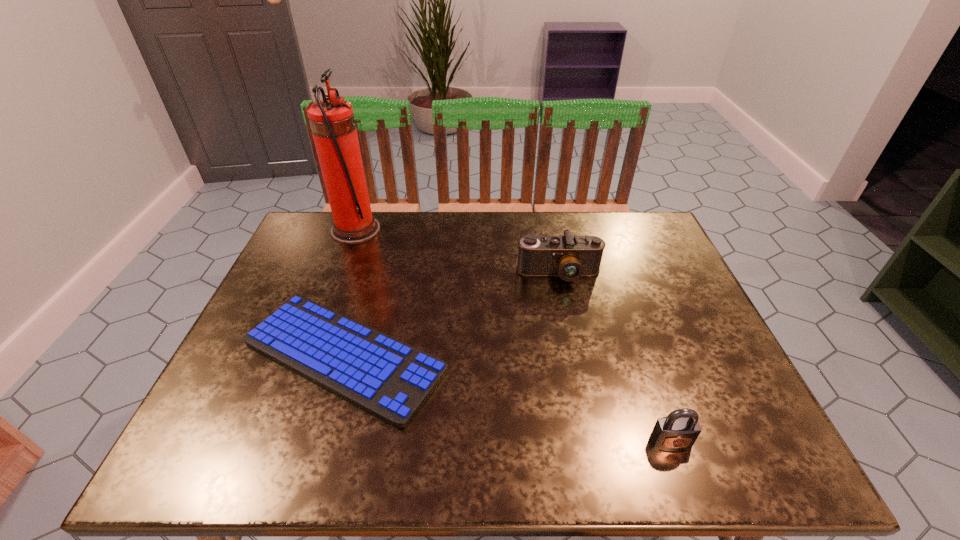
Where is `fire extinguisher`? This screenshot has width=960, height=540. fire extinguisher is located at coordinates (332, 122).

Locate an element on the screen. The image size is (960, 540). the farthest object is located at coordinates (332, 122).

Locate an element on the screen. This screenshot has height=540, width=960. the second farthest object is located at coordinates (569, 257).

The image size is (960, 540). In order to click on the nearest object in this screenshot , I will do `click(679, 430)`.

I want to click on the shortest object, so click(389, 379).

Locate an element on the screen. This screenshot has width=960, height=540. computer keyboard is located at coordinates (389, 379).

Image resolution: width=960 pixels, height=540 pixels. What are the coordinates of `free space located 0.060m at the discharge end of the farthest object` in the screenshot? It's located at (398, 230).

Identify the location of vacant space situated on the lens of the camera. The width and height of the screenshot is (960, 540). click(583, 391).

The height and width of the screenshot is (540, 960). I want to click on free space located on the right of the computer keyboard, so [605, 357].

This screenshot has width=960, height=540. In order to click on object at the far edge in this screenshot , I will do `click(332, 122)`.